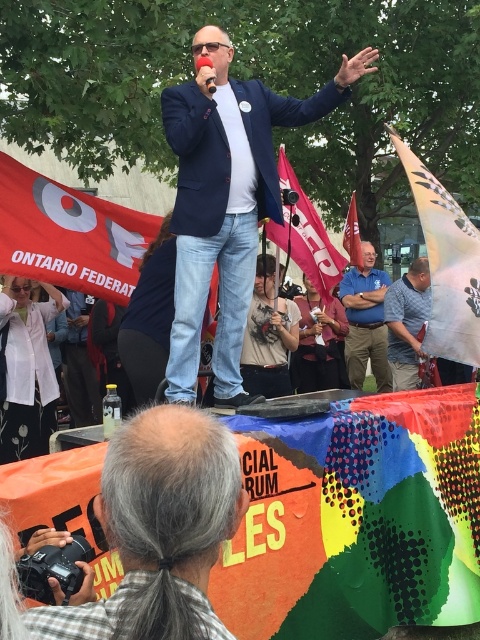
Question: Which object is farther from the camera taking this photo?

Choices:
 (A) white fabric flag at lower right
 (B) red fabric flag at upper center

Answer: (B)

Question: Which of the following is the farthest from the observer?

Choices:
 (A) red fabric flag at upper center
 (B) white fabric flag at lower right
 (C) navy blue blazer at center
 (D) red fabric flag at upper left

Answer: (A)

Question: Based on their relative distances, which object is farther from the khaki cotton shirt at center?

Choices:
 (A) red fabric flag at upper left
 (B) red fabric flag at upper center
 (C) white fabric flag at lower right
 (D) gray striped shirt at lower right

Answer: (B)

Question: Can you confirm if khaki cotton shirt at center is positioned above pink fabric flag at center?

Choices:
 (A) no
 (B) yes

Answer: (A)

Question: Is blue cotton shirt at center below red fabric flag at upper center?

Choices:
 (A) no
 (B) yes

Answer: (B)

Question: Can you confirm if navy blue blazer at center is thinner than pink fabric flag at center?

Choices:
 (A) yes
 (B) no

Answer: (B)